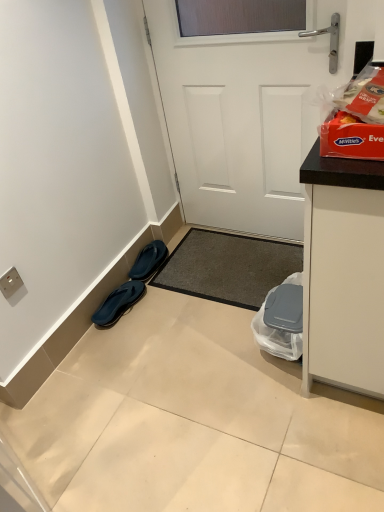
Question: In terms of width, does black rubber flip-flops at lower left, which is counted as the 1th footwear, starting from the top, look wider or thinner when compared to white plastic electric outlet at lower left?

Choices:
 (A) thin
 (B) wide

Answer: (B)

Question: From the image's perspective, is black rubber flip-flops at lower left, which ranks as the second footwear in bottom-to-top order, located above or below white plastic electric outlet at lower left?

Choices:
 (A) above
 (B) below

Answer: (A)

Question: Considering the real-world distances, which object is closest to the white matte door at center?

Choices:
 (A) red cardboard box of mcvitie's everlasting wafers at upper right
 (B) white plastic electric outlet at lower left
 (C) black rubber flip-flops at lower left, which appears as the 1th footwear when ordered from the bottom
 (D) dark gray carpet at center
 (E) black rubber flip-flops at lower left, which ranks as the second footwear in bottom-to-top order

Answer: (D)

Question: Estimate the real-world distances between objects in this image. Which object is closer to the black rubber flip-flops at lower left, which ranks as the second footwear in bottom-to-top order?

Choices:
 (A) black rubber flip-flops at lower left, which appears as the 1th footwear when ordered from the bottom
 (B) dark gray carpet at center
 (C) white matte door at center
 (D) red cardboard box of mcvitie's everlasting wafers at upper right
 (E) white plastic electric outlet at lower left

Answer: (A)